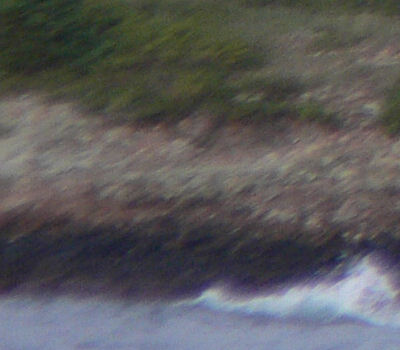
I want to click on small green plants, so click(180, 89).